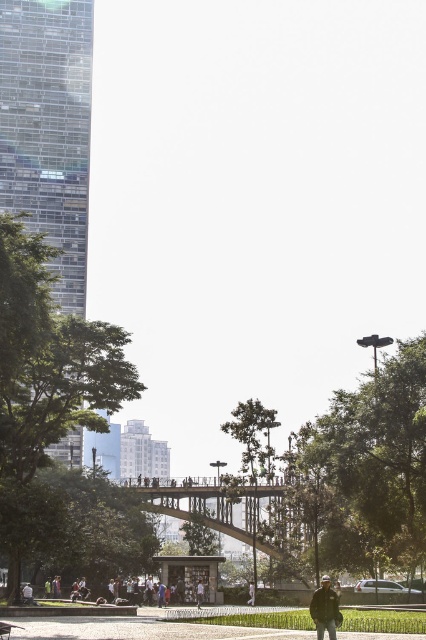
Between light brown leather jacket at center and white fabric shirt at center, which one appears on the left side from the viewer's perspective?

light brown leather jacket at center is more to the left.

Does point (195, 596) come in front of point (252, 588)?

No, (195, 596) is behind (252, 588).

You are a GUI agent. You are given a task and a screenshot of the screen. Output one action in this format:
    pyautogui.click(x=<x>, y=<y>)
    Task: Click on the light brown leather jacket at center
    This screenshot has width=426, height=640.
    Given the screenshot: What is the action you would take?
    pyautogui.click(x=199, y=593)

Which is more to the left, dark blue jacket at lower center or white fabric shirt at center?

Positioned to the left is white fabric shirt at center.

Locate an element on the screen. dark blue jacket at lower center is located at coordinates (325, 609).

Is point (313, 612) more distant than point (253, 596)?

No, it is not.

You are a GUI agent. You are given a task and a screenshot of the screen. Output one action in this format:
    pyautogui.click(x=<x>, y=<y>)
    Task: Click on the dark blue jacket at lower center
    The image size is (426, 640).
    Given the screenshot: What is the action you would take?
    pyautogui.click(x=325, y=609)

Does dark blue jacket at lower center have a larger size compared to light brown leather jacket at center?

Yes.

Who is more distant from viewer, (334, 636) or (198, 593)?

The point (198, 593) is behind.

Locate an element on the screen. dark blue jacket at lower center is located at coordinates (325, 609).

Where is `dark blue jacket at lower center`? The image size is (426, 640). dark blue jacket at lower center is located at coordinates (325, 609).